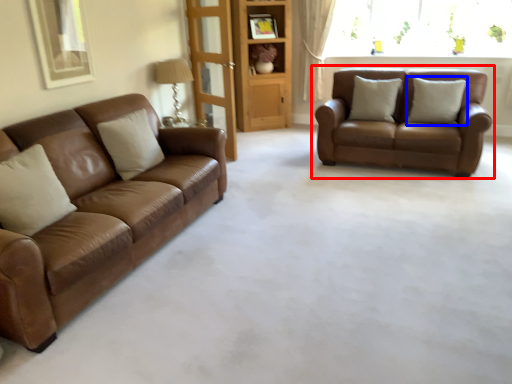
Question: Among these objects, which one is farthest to the camera, studio couch (highlighted by a red box) or pillow (highlighted by a blue box)?

Choices:
 (A) studio couch
 (B) pillow

Answer: (B)